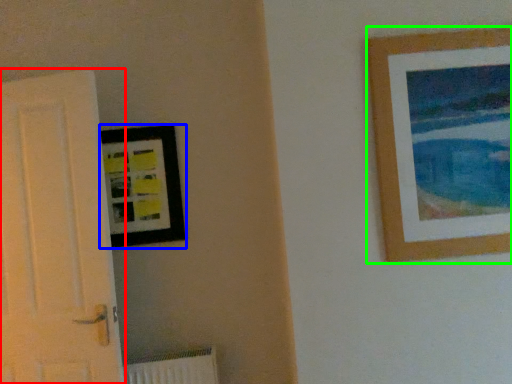
Question: Which object is positioned closest to door (highlighted by a red box)? Select from picture frame (highlighted by a blue box) and picture frame (highlighted by a green box).

Choices:
 (A) picture frame
 (B) picture frame

Answer: (A)